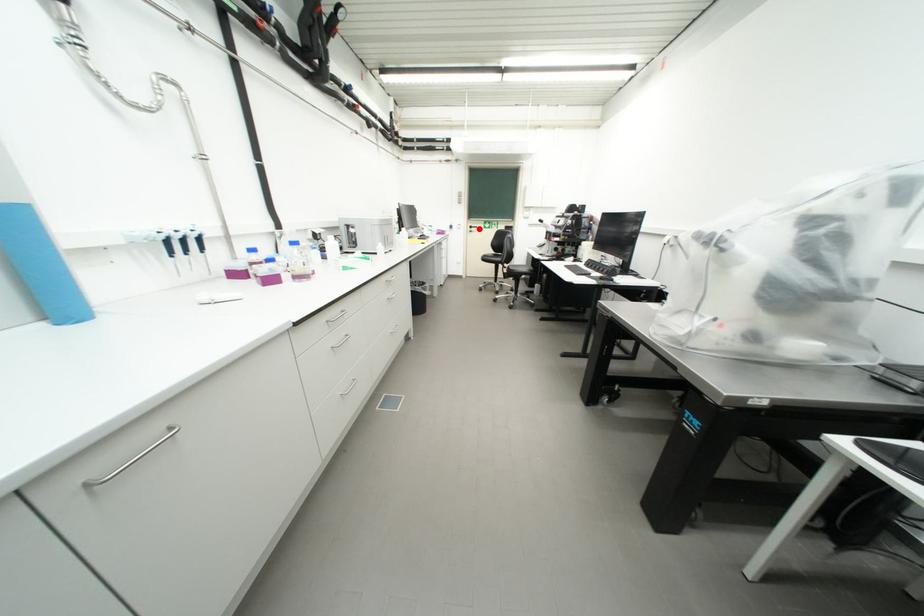
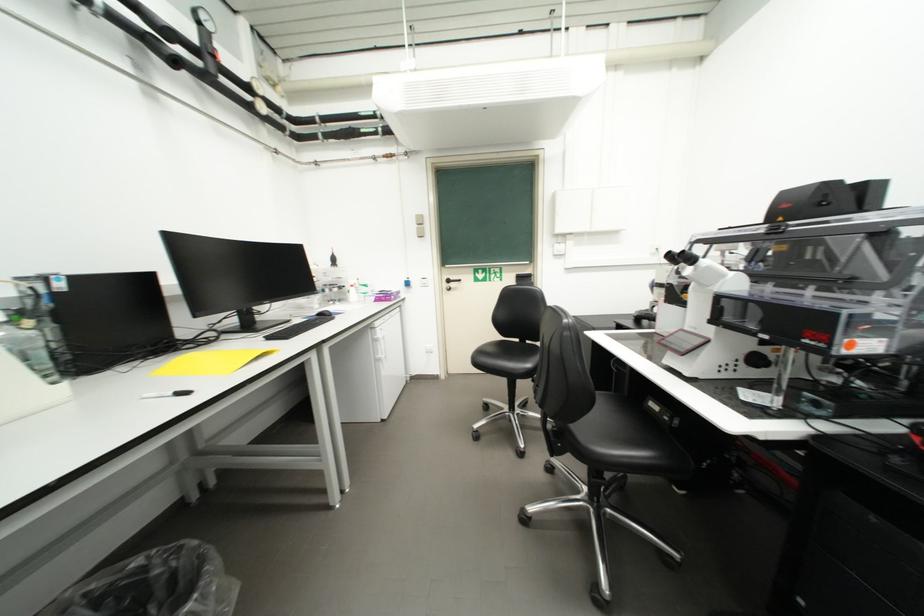
Question: A red point is marked in image1. In image2, is the corresponding 3D point closer to the camera or farther? Reply with the corresponding letter.

Choices:
 (A) The corresponding 3D point is closer.
 (B) The corresponding 3D point is farther.

Answer: (B)